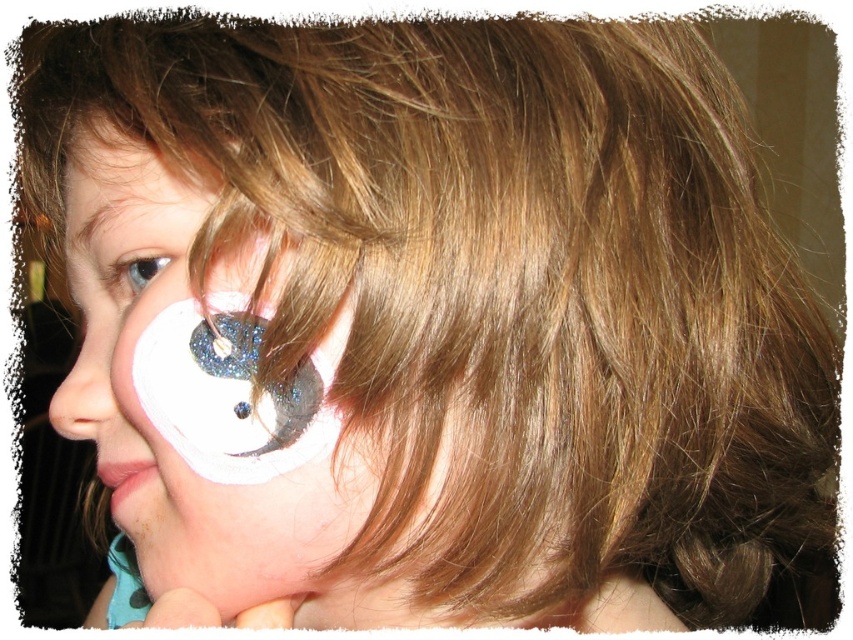
Based on the scene description, which object is larger in size between the white matte face paint at upper left and the matte white nose at lower left?

The white matte face paint at upper left is bigger than the matte white nose at lower left according to the description.

You are an artist who needs to apply a new design on the child. You have two options for placement. The first is the white matte face paint at center, and the second is the white glittery eye at upper left. Which area is wider?

The white matte face paint at center might be wider than white glittery eye at upper left.